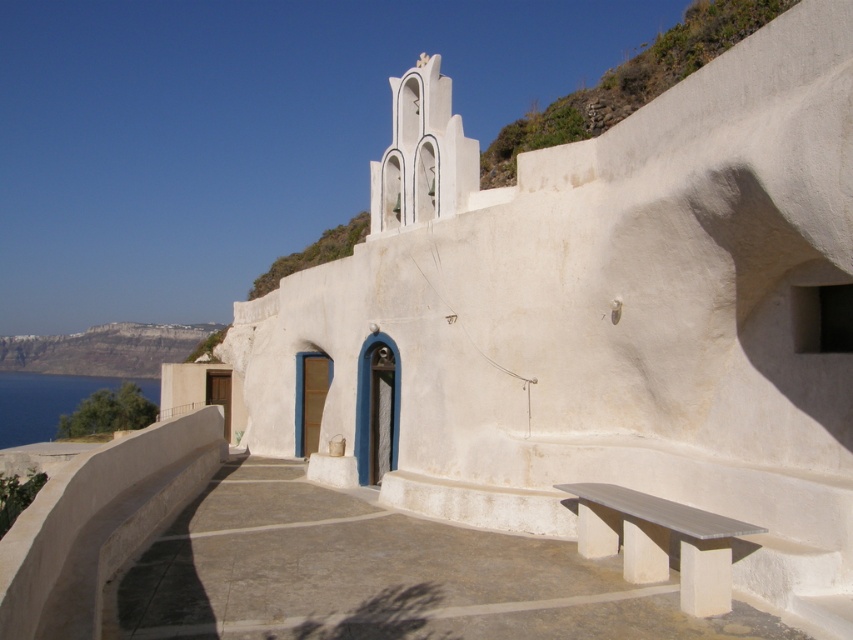
You are standing at the entrance of the whitewashed building and want to sit on the smooth white bench at lower right. In which direction should you walk to reach it?

The smooth white bench at lower right is located at coordinates point (660, 541), so you should walk towards the lower right direction to reach it.

You are standing at the entrance of the whitewashed building with two blue doors. Looking towards the upper right corner of the image, can you see a point marked at coordinates (628,83)? Where exactly is this point located?

The point at (628,83) is located on the greenish brown rocky hillside at upper right.